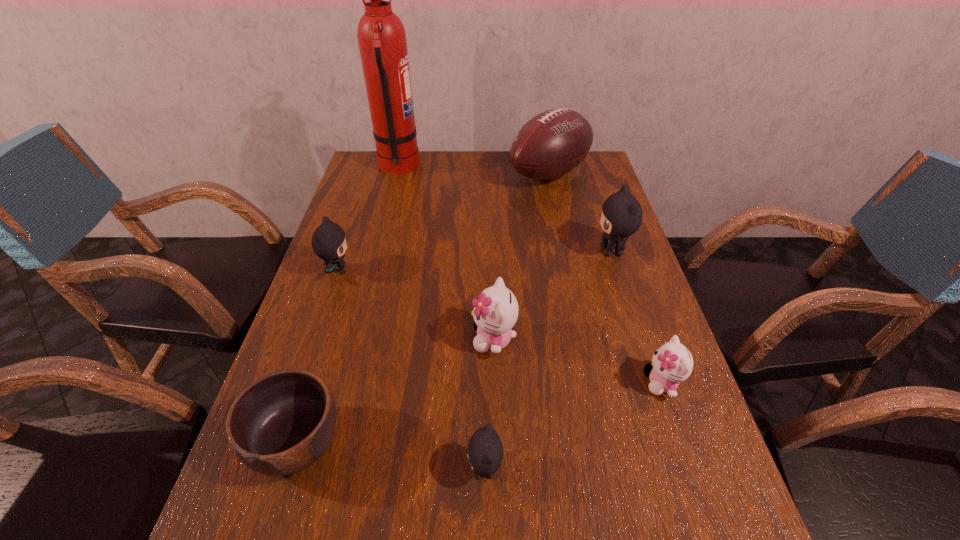
Locate an element on the screen. the fourth closest kitten to the nearest gray kitten is located at coordinates (621, 216).

This screenshot has height=540, width=960. Find the location of `the third closest gray kitten to the smaller white kitten`. the third closest gray kitten to the smaller white kitten is located at coordinates (329, 242).

Identify which gray kitten is the third nearest to the bowl. Please provide its 2D coordinates. Your answer should be formatted as a tuple, i.e. [(x, y)], where the tuple contains the x and y coordinates of a point satisfying the conditions above.

[(621, 216)]

Image resolution: width=960 pixels, height=540 pixels. Find the location of `free spot that satisfies the following two spatial constraints: 1. on the front-facing side of the smaller white kitten; 2. on the front side of the bowl`. free spot that satisfies the following two spatial constraints: 1. on the front-facing side of the smaller white kitten; 2. on the front side of the bowl is located at coordinates (683, 443).

Where is `blank space that satisfies the following two spatial constraints: 1. on the front-facing side of the second biggest gray kitten; 2. on the back side of the bowl`? This screenshot has width=960, height=540. blank space that satisfies the following two spatial constraints: 1. on the front-facing side of the second biggest gray kitten; 2. on the back side of the bowl is located at coordinates tap(279, 443).